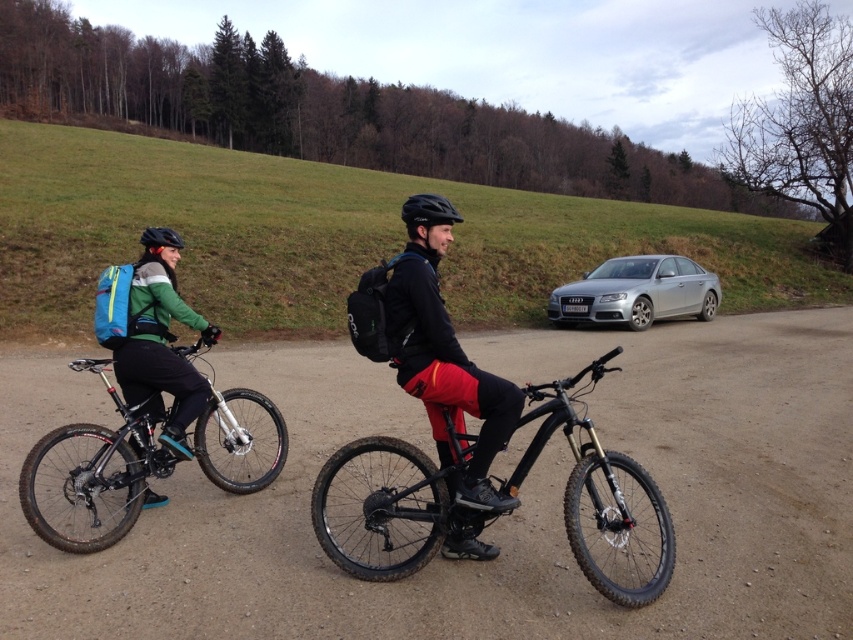
Looking at this image, you are a photographer standing at the starting point of the dirt road. You want to take a photo of the black rubber bicycle at center so that it appears larger in the photo. What should you do?

To make the black rubber bicycle at center appear larger in the photo, you should move closer to it.

You are a photographer planning to take a picture of the two cyclists and the parked car. You want to ensure that the shiny black frame at center is visible in your shot. Based on the scene description, where should you position your camera relative to the point at coordinates (392, 506)?

The point at coordinates (392, 506) corresponds to the shiny black frame at center. To capture the shiny black frame at center in your photo, position the camera directly facing this point to ensure it is centered in the frame.

Two cyclists are riding on a dirt road. The person on the left is wearing a green jacket, black pants, and a blue backpack. The person on the right is wearing a black jacket, red pants, and a black helmet. They are both on mountain bikes. There is a shiny black frame at center. How far apart are the two cyclists?

The two cyclists are 3.71 meters apart.